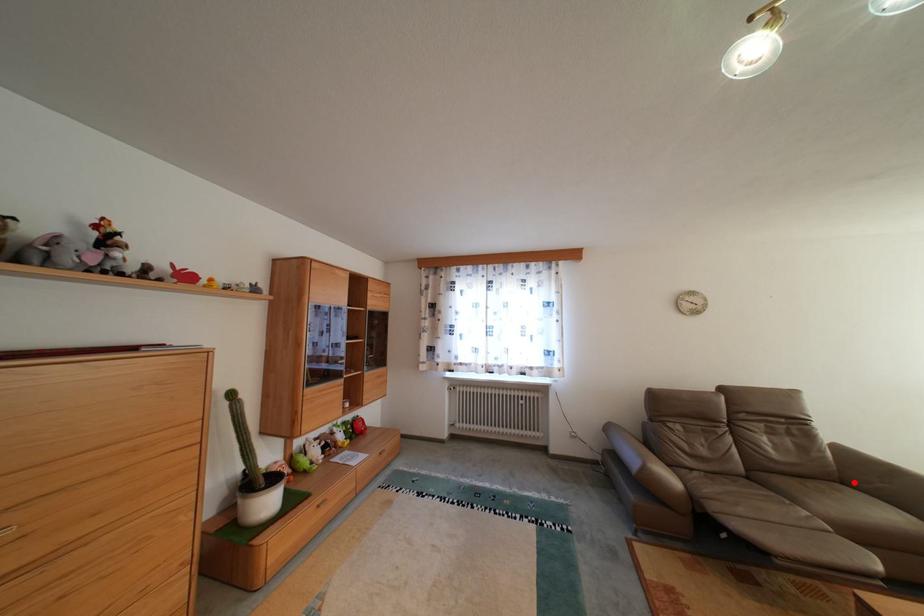
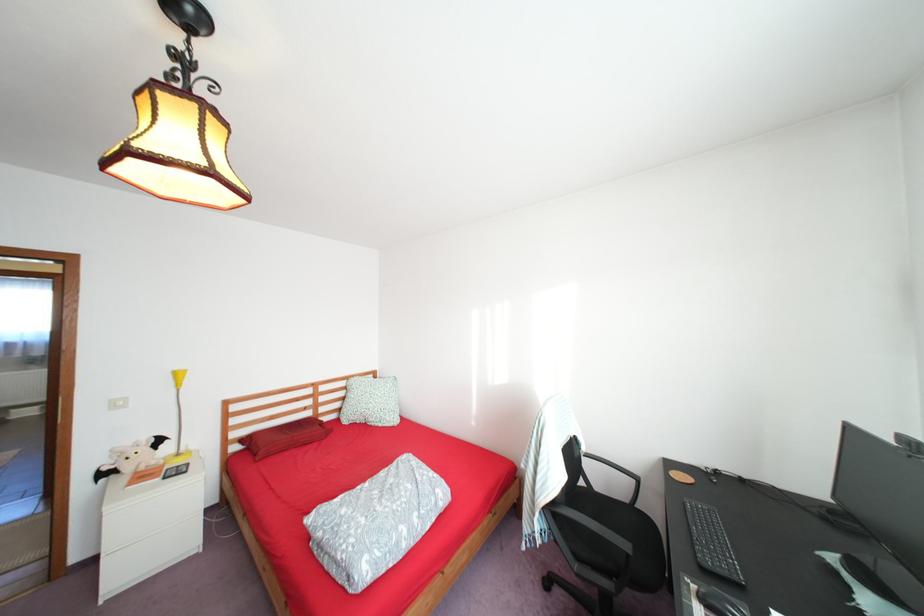
Question: I am providing you with two images of the same scene from different viewpoints. A red point is marked on the first image. Is the red point's position out of view in image 2?

Choices:
 (A) Yes
 (B) No

Answer: (A)